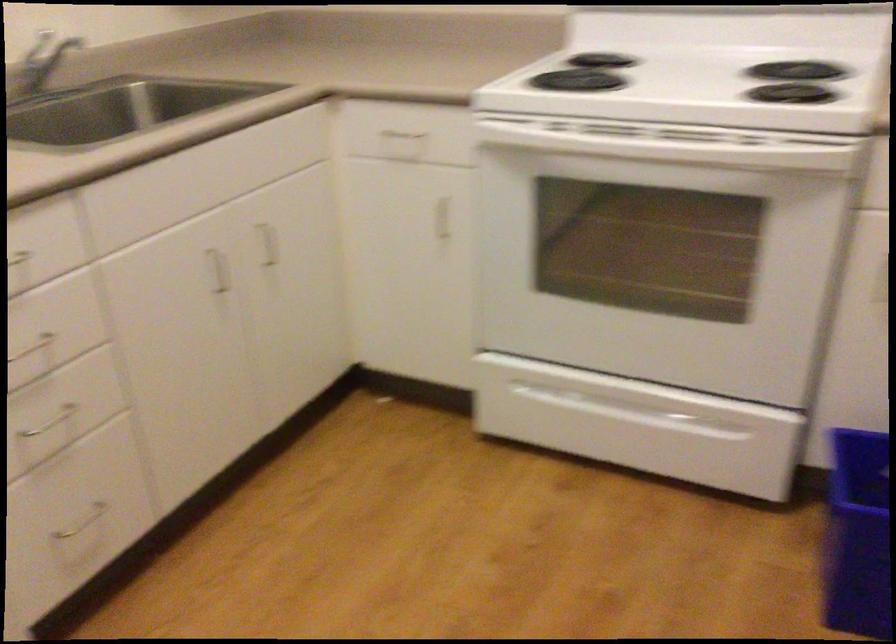
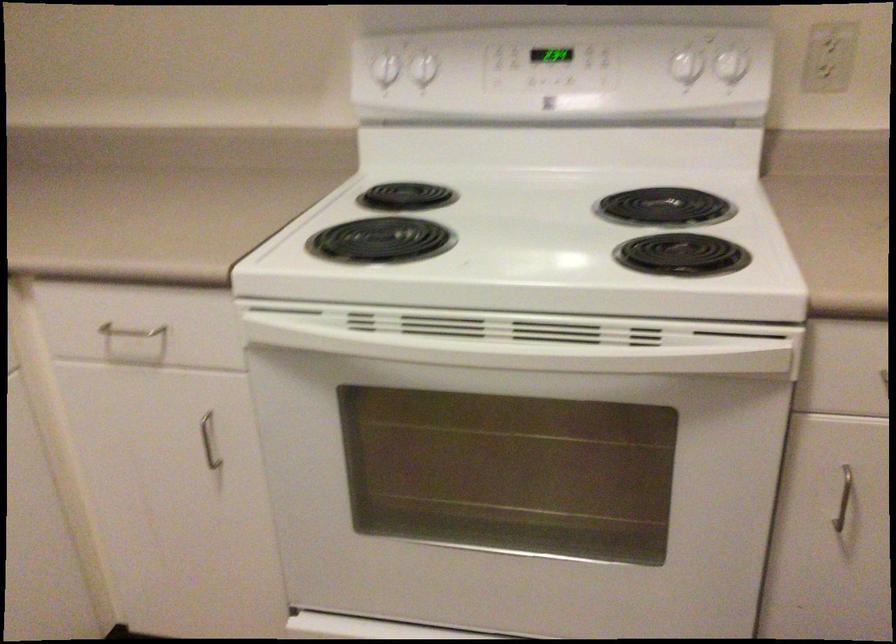
The point at (794, 93) is marked in the first image. Where is the corresponding point in the second image?

(682, 254)